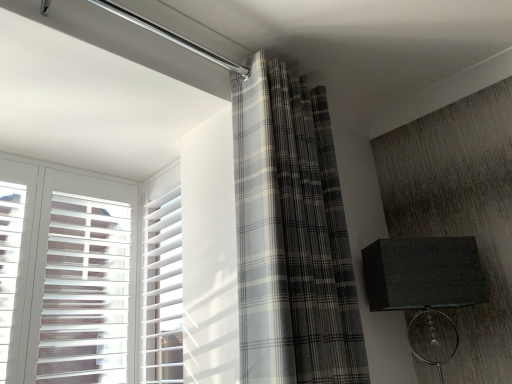
Question: Does white plastic blinds at left have a greater width compared to matte black lampshade at right?

Choices:
 (A) yes
 (B) no

Answer: (B)

Question: Is white plastic blinds at left oriented away from matte black lampshade at right?

Choices:
 (A) no
 (B) yes

Answer: (A)

Question: Would you consider white plastic blinds at left to be distant from matte black lampshade at right?

Choices:
 (A) yes
 (B) no

Answer: (B)

Question: From the image's perspective, is white plastic blinds at left on matte black lampshade at right?

Choices:
 (A) no
 (B) yes

Answer: (B)

Question: Does white plastic blinds at left have a greater height compared to matte black lampshade at right?

Choices:
 (A) no
 (B) yes

Answer: (B)

Question: Does white plastic blinds at left appear on the right side of matte black lampshade at right?

Choices:
 (A) no
 (B) yes

Answer: (A)

Question: From a real-world perspective, is matte black lampshade at right located higher than white plastic blinds at left?

Choices:
 (A) no
 (B) yes

Answer: (A)

Question: Is matte black lampshade at right positioned in front of white plastic blinds at left?

Choices:
 (A) yes
 (B) no

Answer: (A)

Question: Could you tell me if matte black lampshade at right is turned towards white plastic blinds at left?

Choices:
 (A) yes
 (B) no

Answer: (B)

Question: Does matte black lampshade at right appear on the left side of white plastic blinds at left?

Choices:
 (A) no
 (B) yes

Answer: (A)

Question: Does matte black lampshade at right have a larger size compared to white plastic blinds at left?

Choices:
 (A) no
 (B) yes

Answer: (B)

Question: Is matte black lampshade at right turned away from white plastic blinds at left?

Choices:
 (A) yes
 (B) no

Answer: (B)

Question: From a real-world perspective, does matte black lampshade at right sit lower than gray plaid curtain at center?

Choices:
 (A) yes
 (B) no

Answer: (A)